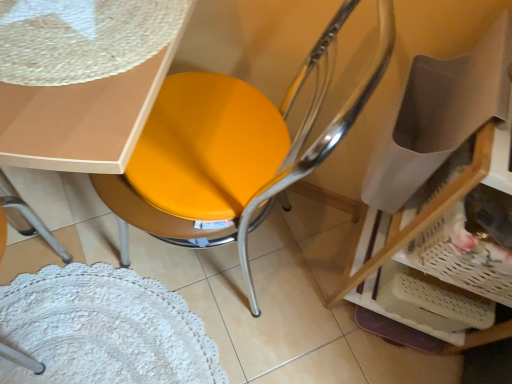
The image size is (512, 384). Identify the location of free spot below matte yellow seat at center (from a real-world perspective). (234, 260).